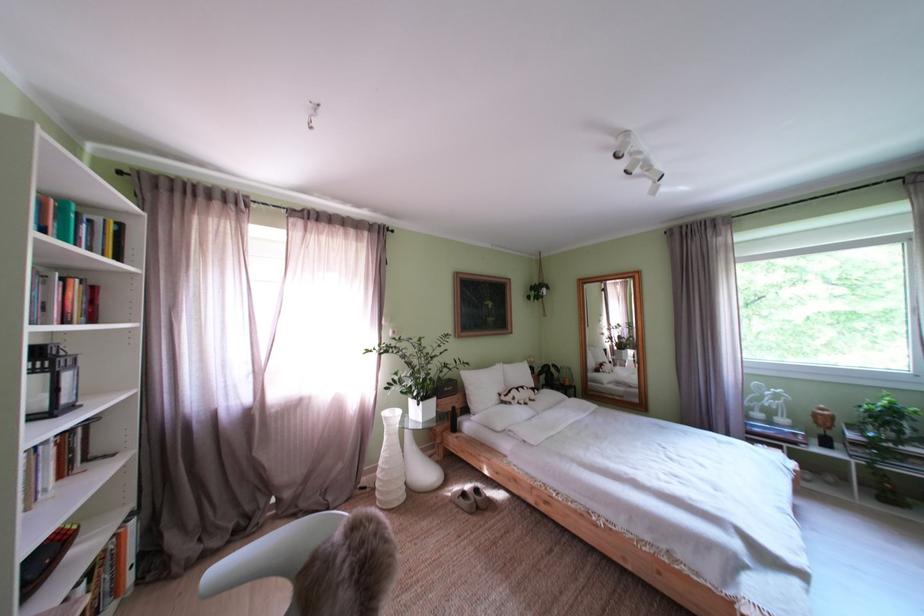
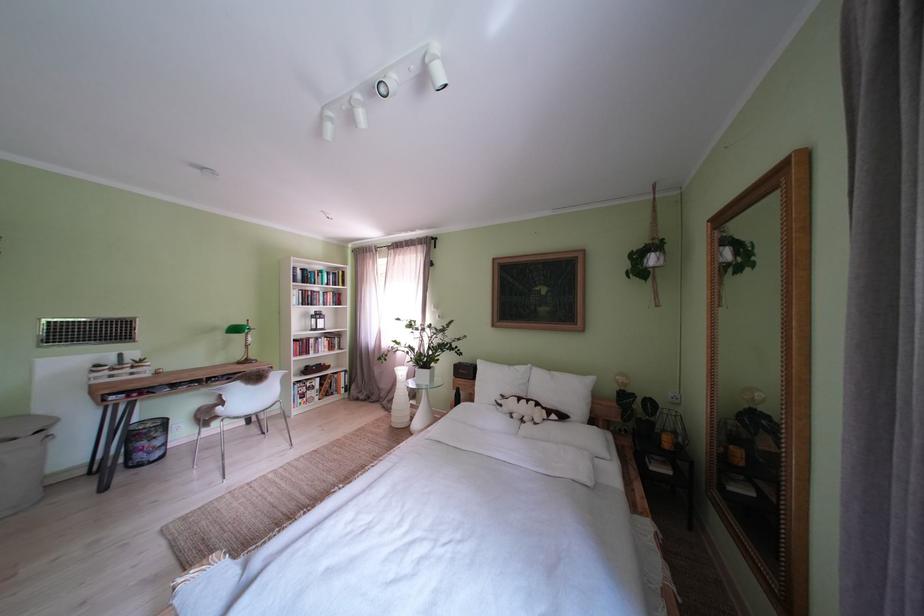
In the second image, find the point that corresponds to the point at 342,505 in the first image.

(400, 411)